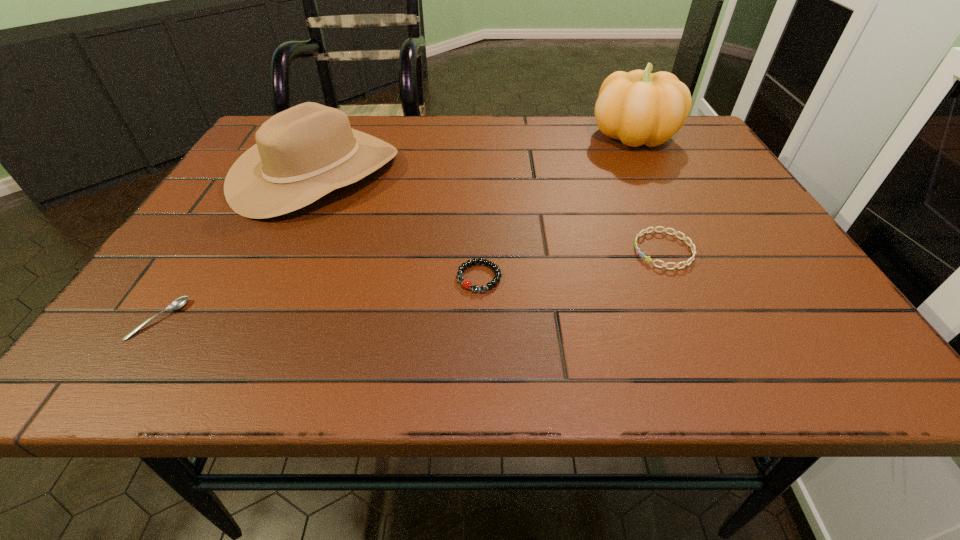
At what (x,y) coordinates should I click in order to perform the action: click on unoccupied area between the right bracelet and the cowboy hat. Please return your answer as a coordinate pair (x, y). This screenshot has width=960, height=540. Looking at the image, I should click on (491, 212).

Locate an element on the screen. vacant area between the fourth shortest object and the left bracelet is located at coordinates (397, 225).

Locate an element on the screen. This screenshot has height=540, width=960. free spot between the right bracelet and the fourth tallest object is located at coordinates (571, 264).

I want to click on free space between the left bracelet and the fourth shortest object, so click(397, 225).

You are a GUI agent. You are given a task and a screenshot of the screen. Output one action in this format:
    pyautogui.click(x=<x>, y=<y>)
    Task: Click on the free space between the tallest object and the right bracelet
    The image size is (960, 540).
    Given the screenshot: What is the action you would take?
    pyautogui.click(x=648, y=192)

Locate an element on the screen. The image size is (960, 540). empty location between the tallest object and the fourth shortest object is located at coordinates 474,154.

The width and height of the screenshot is (960, 540). Find the location of `free area in between the shortest object and the fourth shortest object`. free area in between the shortest object and the fourth shortest object is located at coordinates (238, 246).

Identify the location of the closest object to the second tallest object. The width and height of the screenshot is (960, 540). (465, 283).

This screenshot has width=960, height=540. In order to click on object identified as the closest to the right bracelet in this screenshot , I will do `click(465, 283)`.

At what (x,y) coordinates should I click in order to perform the action: click on vacant point that satisfies the following two spatial constraints: 1. on the front side of the pumpkin; 2. on the surface of the right bracelet showing star-shaped elements. Please return your answer as a coordinate pair (x, y). This screenshot has width=960, height=540. Looking at the image, I should click on (691, 250).